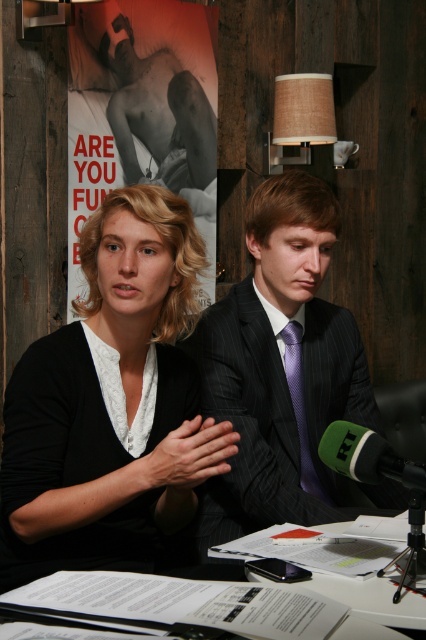
You are a photographer setting up for a photoshoot at the table where the black matte sweater at center is placed. To ensure the sweater is in the frame, where should you position your camera relative to the table?

The black matte sweater at center is located at point (111, 403), so position the camera to focus on that coordinate to include the sweater in the frame.

You are a photographer standing in front of the table where the two people are seated. You want to take a photo of the items on the table. Which of the two points, point [201,140] or point [62,596], is closer to you?

Point [201,140] is further to the viewer than point [62,596], so point [201,140] is closer to you.

Consider the image. You are a photographer preparing to take a closeup shot of the green foam microphone at lower center. However, you notice the black matte sweater at center is blocking the view. Can you estimate if the microphone is smaller than the sweater?

The black matte sweater at center is bigger than the green foam microphone at lower center, so yes, the microphone is smaller and might be partially hidden by the sweater.